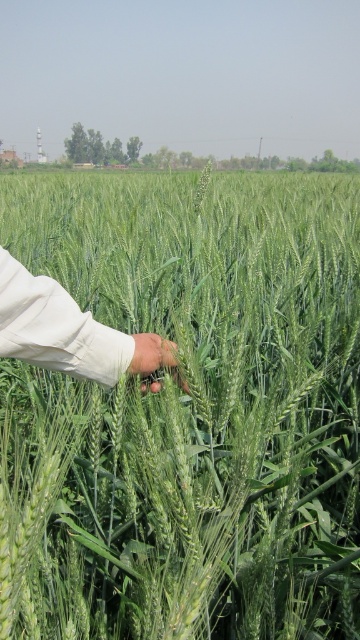
Question: Can you confirm if green matte wheat at center is thinner than light beige fabric hand at center?

Choices:
 (A) yes
 (B) no

Answer: (B)

Question: Which object is closer to the camera taking this photo?

Choices:
 (A) green matte wheat at center
 (B) light beige fabric hand at center

Answer: (B)

Question: Can you confirm if green matte wheat at center is positioned to the right of light beige fabric hand at center?

Choices:
 (A) no
 (B) yes

Answer: (A)

Question: Does green matte wheat at center have a larger size compared to light beige fabric hand at center?

Choices:
 (A) yes
 (B) no

Answer: (A)